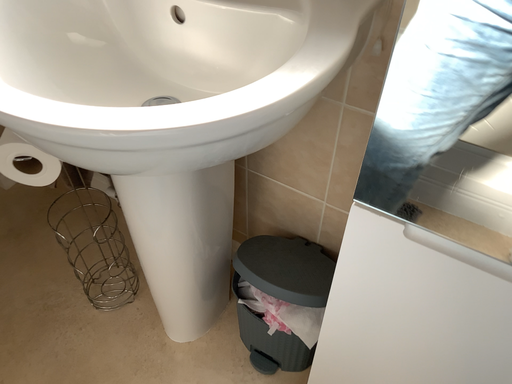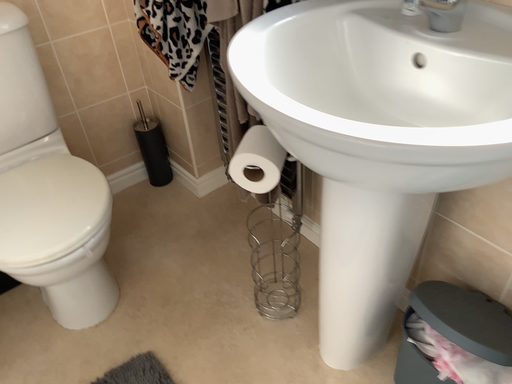
Question: How did the camera likely rotate when shooting the video?

Choices:
 (A) rotated downward
 (B) rotated upward

Answer: (B)